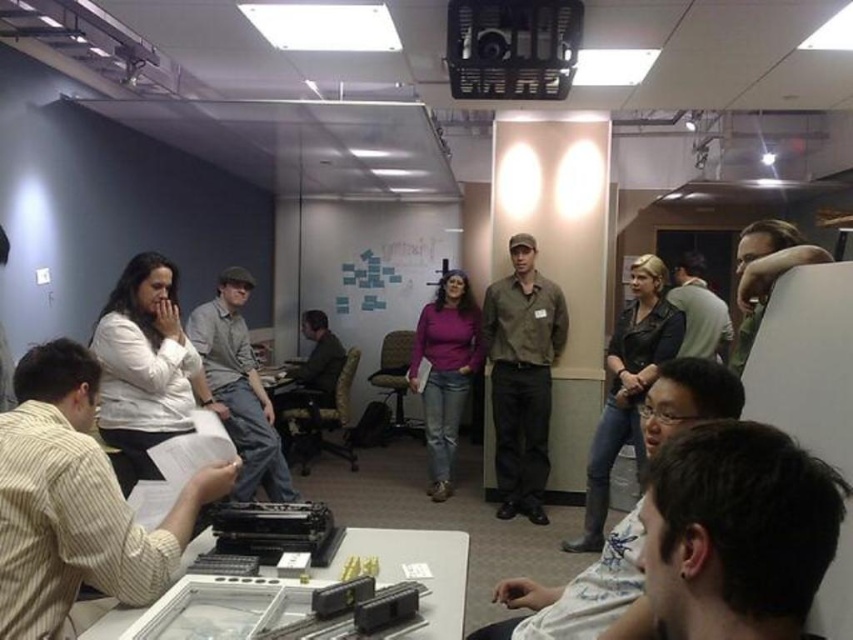
Who is higher up, striped cotton shirt at lower left or matte brown shirt at center?

matte brown shirt at center is higher up.

Who is shorter, striped cotton shirt at lower left or matte brown shirt at center?

striped cotton shirt at lower left is shorter.

Does point (93, 438) lie behind point (502, 337)?

No, it is in front of (502, 337).

Image resolution: width=853 pixels, height=640 pixels. I want to click on striped cotton shirt at lower left, so click(74, 502).

Does point (540, 612) lie behind point (770, 227)?

No.

Between dark brown leather jacket at center and dark brown leather jacket at upper right, which one has more height?

With more height is dark brown leather jacket at center.

Who is more distant from viewer, [709,412] or [741,346]?

Positioned behind is point [741,346].

At what (x,y) coordinates should I click in order to perform the action: click on dark brown leather jacket at center. Please return your answer as a coordinate pair (x, y). The height and width of the screenshot is (640, 853). Looking at the image, I should click on pyautogui.click(x=582, y=596).

This screenshot has width=853, height=640. Find the location of `dark brown hair at lower right`. dark brown hair at lower right is located at coordinates (737, 532).

Identify the location of dark brown hair at lower right. Image resolution: width=853 pixels, height=640 pixels. (737, 532).